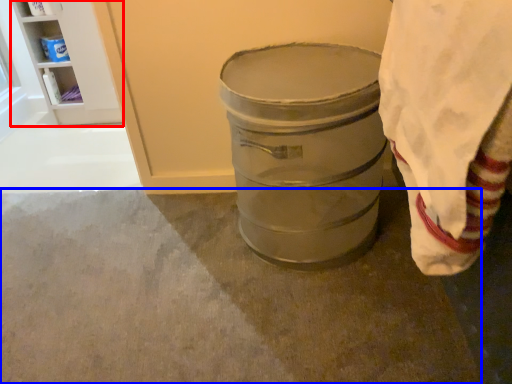
Question: Which object is closer to the camera taking this photo, shelf (highlighted by a red box) or concrete (highlighted by a blue box)?

Choices:
 (A) shelf
 (B) concrete

Answer: (B)